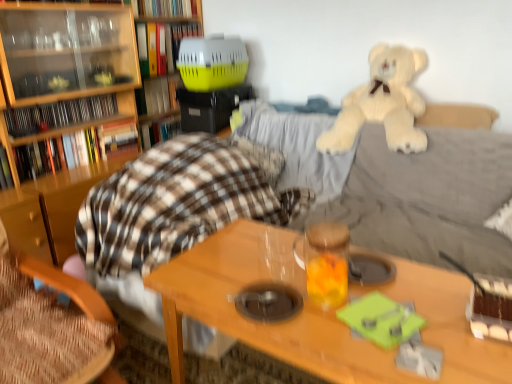
The image size is (512, 384). What do you see at coordinates (59, 114) in the screenshot?
I see `matte black book at left, the fourth book positioned from the top` at bounding box center [59, 114].

What do you see at coordinates (382, 103) in the screenshot?
I see `white plush teddy bear at upper right` at bounding box center [382, 103].

What do you see at coordinates (5, 170) in the screenshot? I see `hardcover book at left, the seventh book in the top-to-bottom sequence` at bounding box center [5, 170].

This screenshot has height=384, width=512. Find the location of `matte black book at left, which appears as the 4th book when ordered from the bottom`. matte black book at left, which appears as the 4th book when ordered from the bottom is located at coordinates (59, 114).

Is plaid fabric blanket at center, the third book positioned from the bottom, facing towards yellow plastic pet carrier at upper center, the 6th book in the bottom-to-top sequence?

No, plaid fabric blanket at center, the third book positioned from the bottom, is not oriented towards yellow plastic pet carrier at upper center, the 6th book in the bottom-to-top sequence.

Which is behind, point (146, 129) or point (154, 70)?

The point (146, 129) is farther from the camera.

Does plaid fabric blanket at center, the fifth book positioned from the top, have a lesser width compared to yellow plastic pet carrier at upper center, the 6th book in the bottom-to-top sequence?

Yes.

Is the depth of plaid fabric blanket at center, the fifth book positioned from the top, greater than that of yellow plastic pet carrier at upper center, arranged as the second book when viewed from the top?

Yes, plaid fabric blanket at center, the fifth book positioned from the top, is further from the viewer.

Is point (238, 336) farther from viewer compared to point (93, 101)?

No, (238, 336) is closer to viewer.

Is wooden table at center positioned beyond the bounds of matte black book at left, the fourth book positioned from the top?

Yes, wooden table at center is outside of matte black book at left, the fourth book positioned from the top.

Is wooden table at center turned away from matte black book at left, the fourth book positioned from the top?

No, wooden table at center is not facing the opposite direction of matte black book at left, the fourth book positioned from the top.

From the picture: Is wooden table at center not near matte black book at left, which appears as the 4th book when ordered from the bottom?

Yes.

Is translucent glass jar at center thinner than wooden chair at lower left?

Yes, translucent glass jar at center is thinner than wooden chair at lower left.

Looking at this image, is translucent glass jar at center looking in the opposite direction of wooden chair at lower left?

That's not correct — translucent glass jar at center is not looking away from wooden chair at lower left.

Is translucent glass jar at center inside the boundaries of wooden chair at lower left, or outside?

translucent glass jar at center is located beyond the bounds of wooden chair at lower left.

Considering the relative positions of translucent glass jar at center and wooden chair at lower left in the image provided, is translucent glass jar at center to the right of wooden chair at lower left from the viewer's perspective?

Yes, translucent glass jar at center is to the right of wooden chair at lower left.

From the image's perspective, is yellow plastic pet carrier at upper center, the 6th book in the bottom-to-top sequence, on white plush teddy bear at upper right?

Indeed, from the image's perspective, yellow plastic pet carrier at upper center, the 6th book in the bottom-to-top sequence, is shown above white plush teddy bear at upper right.

Is point (145, 49) farther from camera compared to point (408, 126)?

That is True.

Is yellow plastic pet carrier at upper center, the 6th book in the bottom-to-top sequence, bigger than white plush teddy bear at upper right?

Incorrect, yellow plastic pet carrier at upper center, the 6th book in the bottom-to-top sequence, is not larger than white plush teddy bear at upper right.

Does point (369, 112) appear closer or farther from the camera than point (164, 107)?

Point (369, 112).

Would you consider white plush teddy bear at upper right to be distant from yellow plastic pet carrier at upper center, which is the third book in top-to-bottom order?

Indeed, white plush teddy bear at upper right is not near yellow plastic pet carrier at upper center, which is the third book in top-to-bottom order.

Is white plush teddy bear at upper right thinner than yellow plastic pet carrier at upper center, the 5th book from the bottom?

In fact, white plush teddy bear at upper right might be wider than yellow plastic pet carrier at upper center, the 5th book from the bottom.

Looking at this image, is white plush teddy bear at upper right at the left side of yellow plastic pet carrier at upper center, the 5th book from the bottom?

Incorrect, white plush teddy bear at upper right is not on the left side of yellow plastic pet carrier at upper center, the 5th book from the bottom.

How many degrees apart are the facing directions of white plush teddy bear at upper right and plaid fabric blanket at center, the fifth book positioned from the top?

93.2 degrees.

Could you tell me if white plush teddy bear at upper right is facing plaid fabric blanket at center, the fifth book positioned from the top?

No, white plush teddy bear at upper right does not turn towards plaid fabric blanket at center, the fifth book positioned from the top.

From a real-world perspective, is white plush teddy bear at upper right beneath plaid fabric blanket at center, the fifth book positioned from the top?

Incorrect, from a real-world perspective, white plush teddy bear at upper right is higher than plaid fabric blanket at center, the fifth book positioned from the top.

Is point (394, 127) positioned behind point (165, 118)?

No, (394, 127) is in front of (165, 118).

Considering the points (187, 5) and (340, 232), which point is behind, point (187, 5) or point (340, 232)?

The point (187, 5) is farther.

There is a translucent glass jar at center. In order to click on the 7th book above it (from the image's perspective) in this screenshot , I will do `click(166, 8)`.

Looking at their sizes, would you say hardcover book at upper center, the first book when ordered from top to bottom, is wider or thinner than translucent glass jar at center?

Clearly, hardcover book at upper center, the first book when ordered from top to bottom, has less width compared to translucent glass jar at center.

Can you confirm if hardcover book at upper center, the first book when ordered from top to bottom, is taller than translucent glass jar at center?

No.

Identify the location of the 3rd book to the left of the yellow plastic pet carrier at upper center, arranged as the second book when viewed from the top, starting your count from the anchor. The width and height of the screenshot is (512, 384). (159, 130).

Locate an element on the screen. The height and width of the screenshot is (384, 512). desk on the right side of matte black book at left, the fourth book positioned from the top is located at coordinates (260, 322).

Looking at the image, which one is located closer to plaid fabric blanket at center, the fifth book positioned from the top, yellow plastic pet carrier at upper center, the 5th book from the bottom, or hardcover book at left, the first book from the bottom?

Based on the image, yellow plastic pet carrier at upper center, the 5th book from the bottom, appears to be nearer to plaid fabric blanket at center, the fifth book positioned from the top.

Which object lies nearer to the anchor point white plush teddy bear at upper right, translucent glass jar at center or yellow plastic pet carrier at upper center, the 6th book in the bottom-to-top sequence?

translucent glass jar at center lies closer to white plush teddy bear at upper right than the other object.

From the image, which object appears to be farther from wooden chair at lower left, matte black book at left, which appears as the 4th book when ordered from the bottom, or plaid fabric blanket at center, the third book positioned from the bottom?

plaid fabric blanket at center, the third book positioned from the bottom.

Which object lies further to the anchor point yellow plastic pet carrier at upper center, which is the third book in top-to-bottom order, hardcover book at left, which is the second book in bottom-to-top order, or plaid fabric blanket at center, the third book positioned from the bottom?

The object further to yellow plastic pet carrier at upper center, which is the third book in top-to-bottom order, is hardcover book at left, which is the second book in bottom-to-top order.

Looking at the image, which one is located closer to wooden table at center, hardcover book at left, which is the second book in bottom-to-top order, or matte black book at left, the fourth book positioned from the top?

hardcover book at left, which is the second book in bottom-to-top order, is closer to wooden table at center.

Based on their spatial positions, is hardcover book at upper center, the first book when ordered from top to bottom, or hardcover book at left, the first book from the bottom, closer to yellow plastic pet carrier at upper center, the 6th book in the bottom-to-top sequence?

hardcover book at upper center, the first book when ordered from top to bottom, is closer to yellow plastic pet carrier at upper center, the 6th book in the bottom-to-top sequence.

Based on their spatial positions, is yellow plastic pet carrier at upper center, arranged as the second book when viewed from the top, or white plush teddy bear at upper right further from hardcover book at upper center, the first book when ordered from top to bottom?

Among the two, white plush teddy bear at upper right is located further to hardcover book at upper center, the first book when ordered from top to bottom.

Which object lies nearer to the anchor point plaid fabric blanket at center, the third book positioned from the bottom, wooden table at center or hardcover book at upper center, which is counted as the 7th book, starting from the bottom?

hardcover book at upper center, which is counted as the 7th book, starting from the bottom.

You are a GUI agent. You are given a task and a screenshot of the screen. Output one action in this format:
    pyautogui.click(x=<x>, y=<y>)
    Task: Click on the chair situated between matte black book at left, the fourth book positioned from the top, and white plush teddy bear at upper right from left to right
    This screenshot has height=384, width=512.
    Given the screenshot: What is the action you would take?
    pyautogui.click(x=48, y=332)

You are a GUI agent. You are given a task and a screenshot of the screen. Output one action in this format:
    pyautogui.click(x=<x>, y=<y>)
    Task: Click on the book between wooden chair at lower left and hardcover book at left, acting as the 6th book starting from the top, from front to back
    
    Given the screenshot: What is the action you would take?
    pyautogui.click(x=5, y=170)

Identify the location of beverage between wooden table at center and yellow plastic pet carrier at upper center, the 6th book in the bottom-to-top sequence, along the z-axis. (327, 263).

Where is `beverage located between wooden chair at lower left and plaid fabric blanket at center, the fifth book positioned from the top, in the depth direction`? Image resolution: width=512 pixels, height=384 pixels. beverage located between wooden chair at lower left and plaid fabric blanket at center, the fifth book positioned from the top, in the depth direction is located at coordinates (327, 263).